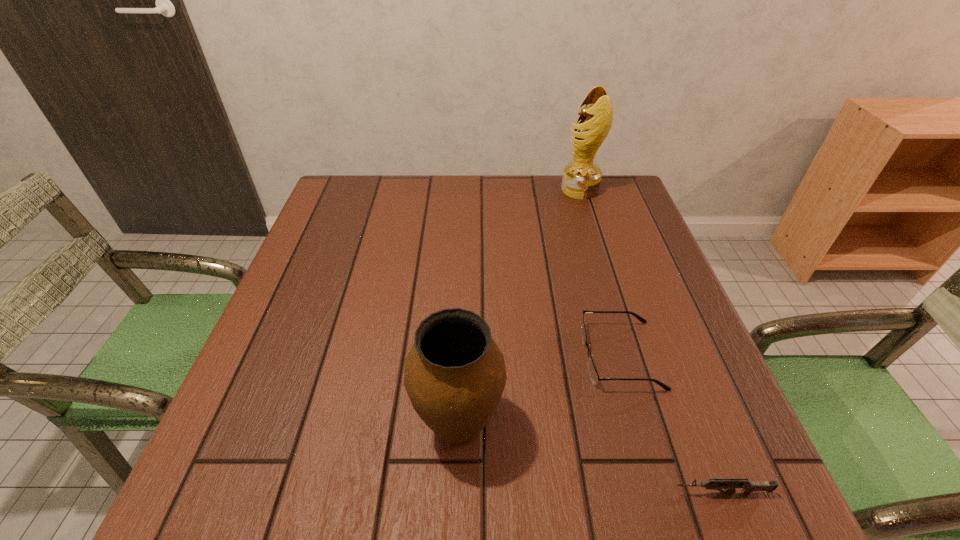
Image resolution: width=960 pixels, height=540 pixels. Identify the location of vacant region located aimed along the barrel of the gun. (505, 492).

The image size is (960, 540). Identify the location of free space located 0.230m aimed along the barrel of the gun. (524, 492).

This screenshot has width=960, height=540. In order to click on free region located aimed along the barrel of the gun in this screenshot , I will do `click(498, 492)`.

Image resolution: width=960 pixels, height=540 pixels. In order to click on free spot located on the front-facing side of the spectacles in this screenshot , I will do `click(396, 355)`.

Image resolution: width=960 pixels, height=540 pixels. I want to click on free space located on the front-facing side of the spectacles, so click(x=461, y=355).

Where is `vacant space situated 0.080m on the front-facing side of the spectacles`? vacant space situated 0.080m on the front-facing side of the spectacles is located at coordinates (542, 355).

Where is `object that is positioned at the far edge`? The width and height of the screenshot is (960, 540). object that is positioned at the far edge is located at coordinates (581, 179).

This screenshot has width=960, height=540. Identify the location of urn located at the near edge. (455, 374).

Locate an element on the screen. gun situated at the near edge is located at coordinates (748, 486).

At what (x,y) coordinates should I click in order to perform the action: click on award that is positioned at the right edge. Please return your answer as a coordinate pair (x, y). Looking at the image, I should click on (581, 179).